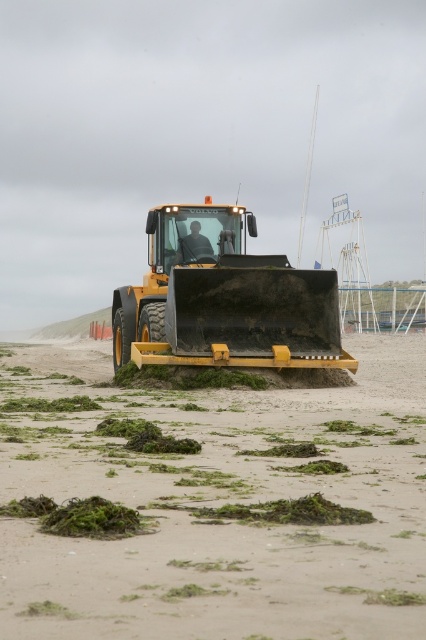
Is point (367, 346) positioned after point (317, 284)?

Yes, point (367, 346) is behind point (317, 284).

This screenshot has height=640, width=426. What are the coordinates of `yellow rubber tractor at center` in the screenshot? It's located at (218, 506).

Does point (417, 445) come closer to viewer compared to point (249, 291)?

Yes, it is.

The height and width of the screenshot is (640, 426). What are the coordinates of `yellow rubber tractor at center` in the screenshot? It's located at coord(218,506).